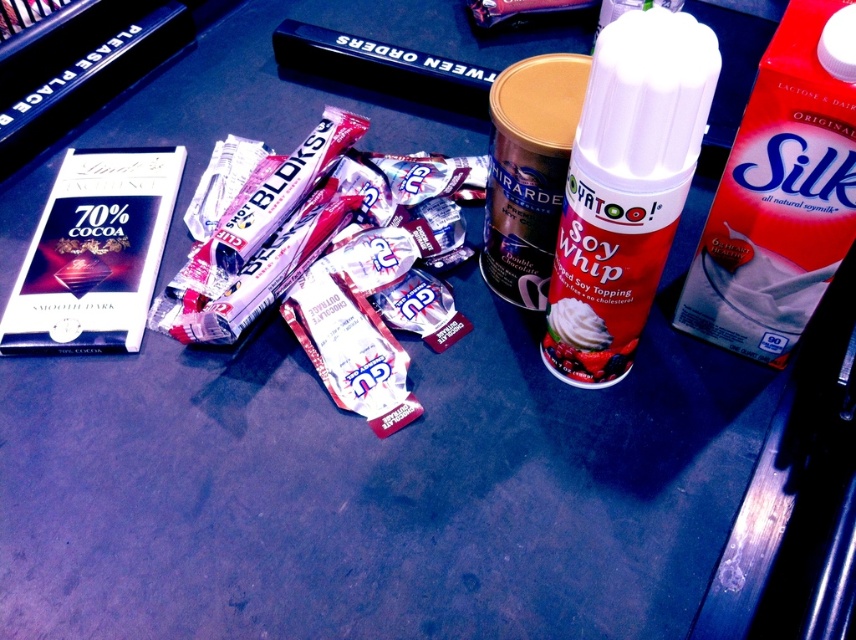
You are organizing a picnic and have a small backpack with a 15 cm wide compartment. You need to decide whether to place the red cardboard carton at right or the metallic gold canister at center into this compartment. Based on their sizes, which item would fit better?

The metallic gold canister at center would fit better in the 15 cm wide compartment since the red cardboard carton at right is wider than it.

You are a chef preparing a dessert and need to place the red matte soy whip can at center and the metallic gold canister at center on a shelf that is 6 inches wide. Can both items fit side by side on the shelf without overlapping?

The red matte soy whip can at center is 4.53 inches from the metallic gold canister at center. Since the total distance between them is less than the 6 inch shelf width, both items can fit side by side on the shelf without overlapping.